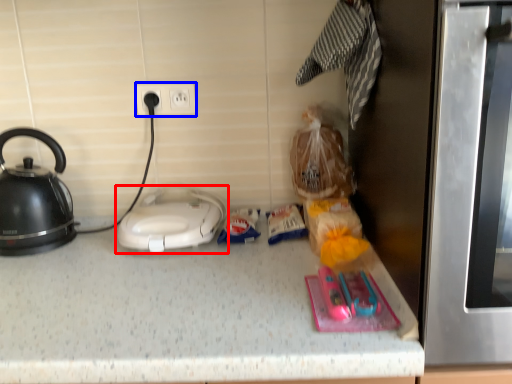
Question: Which object appears closest to the camera in this image, home appliance (highlighted by a red box) or electric outlet (highlighted by a blue box)?

Choices:
 (A) home appliance
 (B) electric outlet

Answer: (A)